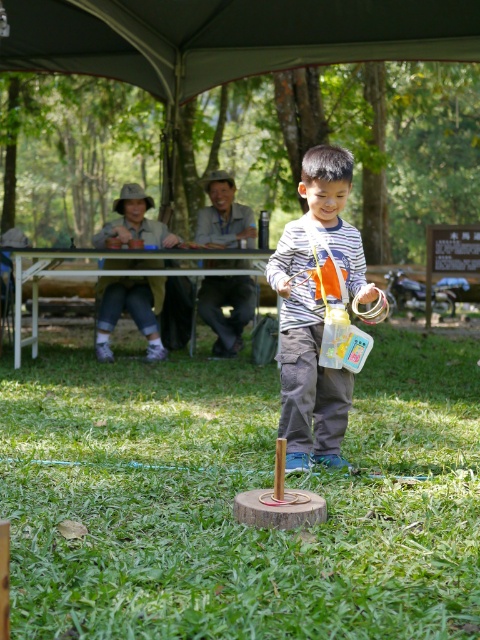
Locate an element on the screen. green grass at center is located at coordinates (237, 492).

Is green grass at center closer to camera compared to dark gray fabric canopy at upper center?

Yes, it is in front of dark gray fabric canopy at upper center.

Is point (133, 451) behind point (458, 36)?

No.

This screenshot has width=480, height=640. I want to click on green grass at center, so click(x=237, y=492).

Looking at this image, can you confirm if dark gray fabric canopy at upper center is positioned above striped fabric boy at center?

Indeed, dark gray fabric canopy at upper center is positioned over striped fabric boy at center.

Between dark gray fabric canopy at upper center and striped fabric boy at center, which one has less height?

striped fabric boy at center is shorter.

Is point (15, 61) positioned in front of point (333, 296)?

No, (15, 61) is behind (333, 296).

Where is `dark gray fabric canopy at upper center`? The width and height of the screenshot is (480, 640). dark gray fabric canopy at upper center is located at coordinates (228, 36).

Is striped fabric boy at center above white plastic picnic table at upper center?

Incorrect, striped fabric boy at center is not positioned above white plastic picnic table at upper center.

Where is `striped fabric boy at center`? striped fabric boy at center is located at coordinates (315, 308).

At what (x,y) coordinates should I click in order to perform the action: click on striped fabric boy at center. Please return your answer as a coordinate pair (x, y). The height and width of the screenshot is (640, 480). Looking at the image, I should click on (315, 308).